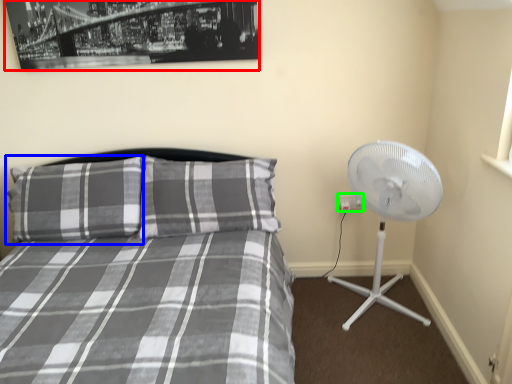
Question: Which object is the closest to the picture frame (highlighted by a red box)? Choose among these: pillow (highlighted by a blue box) or electric outlet (highlighted by a green box).

Choices:
 (A) pillow
 (B) electric outlet

Answer: (A)